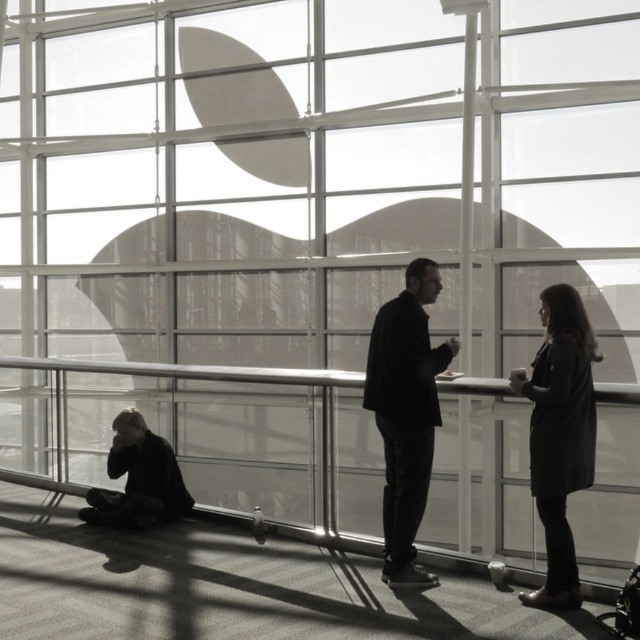
Question: Can you confirm if metallic glass rail at lower center is thinner than dark gray coat at lower left?

Choices:
 (A) no
 (B) yes

Answer: (A)

Question: Which object is the farthest from the dark gray coat at lower left?

Choices:
 (A) metallic glass rail at lower center
 (B) black matte suit at center
 (C) dark gray coat at right

Answer: (C)

Question: Is black matte suit at center to the right of dark gray coat at lower left from the viewer's perspective?

Choices:
 (A) no
 (B) yes

Answer: (B)

Question: Among these points, which one is nearest to the camera?

Choices:
 (A) pos(561,484)
 (B) pos(381,316)
 (C) pos(326,484)
 (D) pos(118,436)

Answer: (A)

Question: Can you confirm if black matte suit at center is smaller than dark gray coat at right?

Choices:
 (A) no
 (B) yes

Answer: (A)

Question: Which is farther from the black matte suit at center?

Choices:
 (A) dark gray coat at lower left
 (B) metallic glass rail at lower center

Answer: (A)